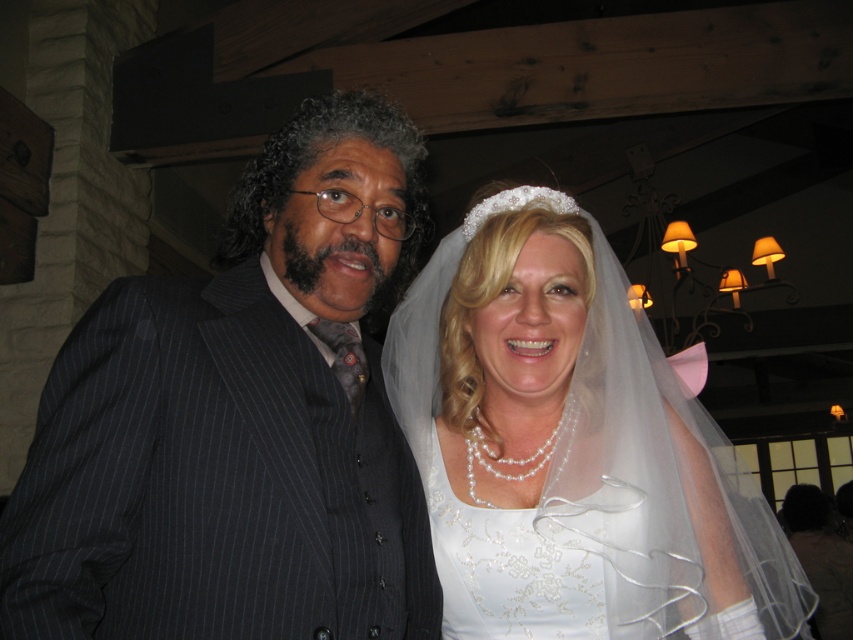
You are a photographer at a wedding reception. You need to capture a photo of the dark pinstripe suit at left and the white satin dress at center. The camera you are using has a minimum focus distance of 10 inches. Will you be able to focus on both subjects clearly?

The dark pinstripe suit at left and white satin dress at center are 11.22 inches apart from each other. Since the minimum focus distance is 10 inches, the camera can focus on both subjects clearly as the distance between them is greater than the required minimum.

You are a photographer at a wedding reception. You need to position the dark pinstripe suit at left and the white satin dress at center so that both are visible in the frame. Which one should you adjust to ensure they are both fully visible?

The dark pinstripe suit at left is shorter than the white satin dress at center, so you should lower the camera angle to accommodate the height difference and ensure both are fully visible.

You are a photographer at a wedding reception and need to position yourself to capture both the man in the dark pinstripe suit and the bride in the white wedding gown in a single shot. The man is located at point (354, 145) and the bride is at point (479, 516). Based on their positions, which person should you focus on first to ensure both are in frame?

You should focus on the bride at point (479, 516) first because point (354, 145) is closer to the viewer than point (479, 516). This means the man is nearer to you, so starting with the bride ensures you can adjust the camera to include both in the frame.